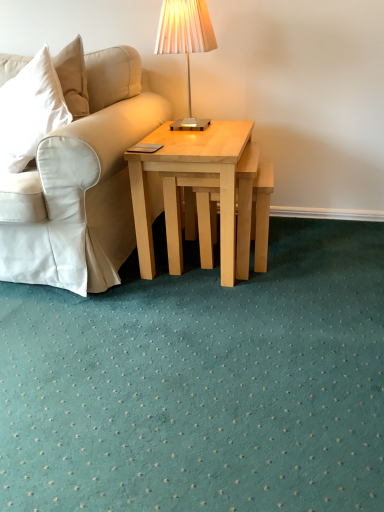
Where is `free spot above natural wood coffee table at center (from a real-world perspective)`? The width and height of the screenshot is (384, 512). free spot above natural wood coffee table at center (from a real-world perspective) is located at coordinates (200, 132).